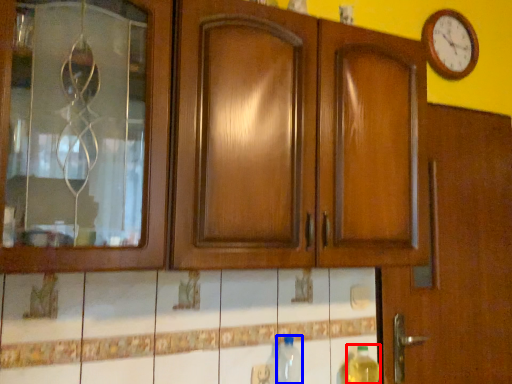
Question: Which point is further to the camera, bottle (highlighted by a red box) or bottle (highlighted by a blue box)?

Choices:
 (A) bottle
 (B) bottle

Answer: (A)